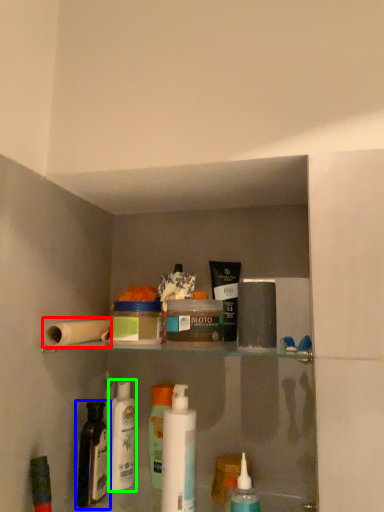
Question: Which object is the farthest from toilet paper (highlighted by a red box)? Choose among these: bottle (highlighted by a blue box) or toiletry (highlighted by a green box).

Choices:
 (A) bottle
 (B) toiletry

Answer: (B)